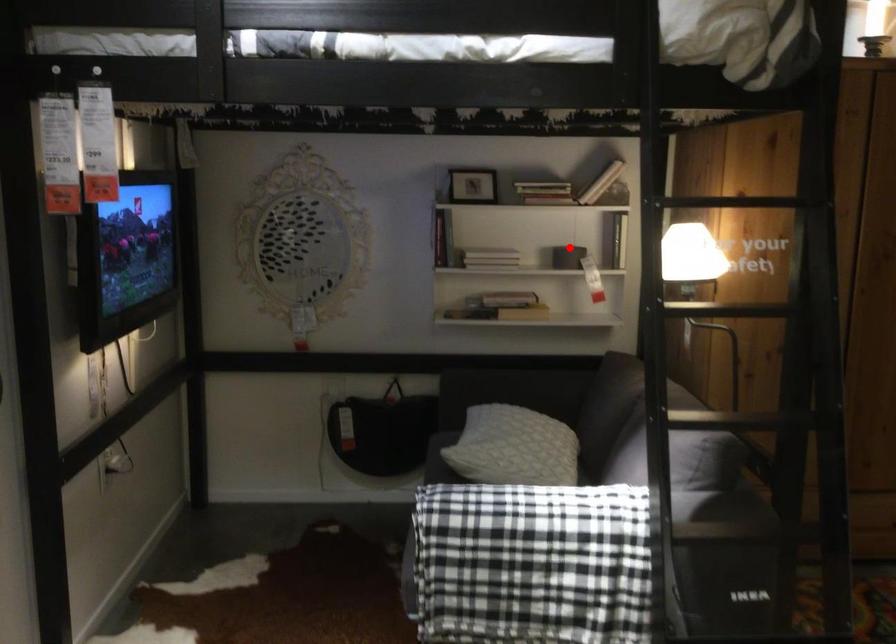
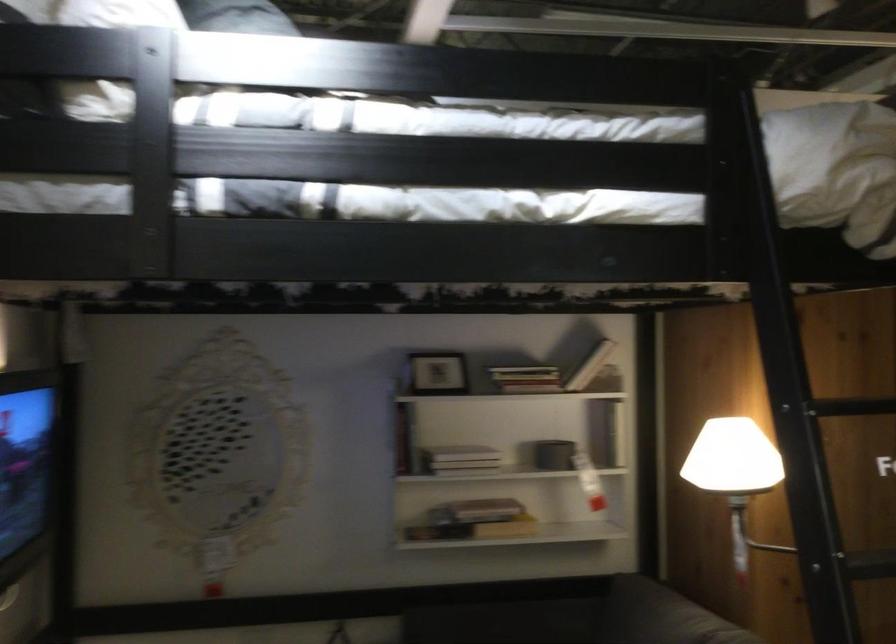
Question: I am providing you with two images of the same scene from different viewpoints. A red point is shown in image1. For the corresponding object point in image2, is it positioned nearer or farther from the camera?

Choices:
 (A) Nearer
 (B) Farther

Answer: (A)